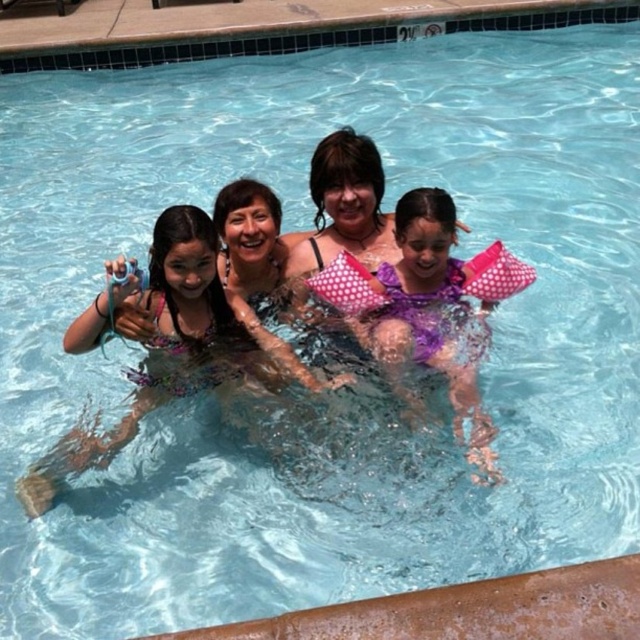
You are a lifeguard observing the pool area. You notice the purple polka dot swimsuit at left. Where exactly is it positioned in the image?

The purple polka dot swimsuit at left is located at point coordinates of 0.536 on the x axis and 0.245 on the y axis.